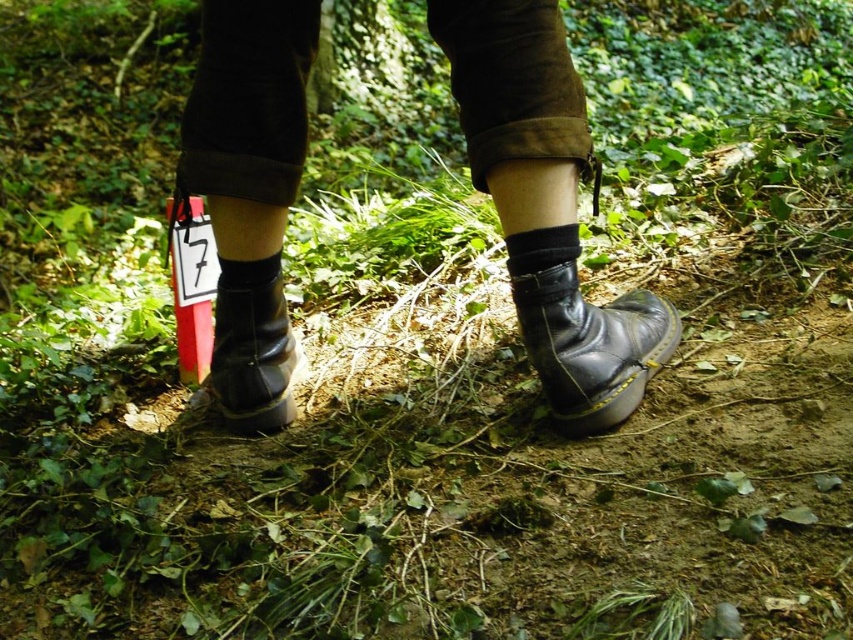
Question: Which of the following is the farthest from the observer?

Choices:
 (A) (532, 285)
 (B) (225, 276)
 (C) (514, 253)
 (D) (254, 419)

Answer: (B)

Question: Does black leather boots at center appear on the left side of black matte sock at lower center?

Choices:
 (A) yes
 (B) no

Answer: (B)

Question: Among these points, which one is nearest to the camera?

Choices:
 (A) (602, 396)
 (B) (260, 259)

Answer: (A)

Question: Is black leather boot at center smaller than black leather hiking boot at lower left?

Choices:
 (A) no
 (B) yes

Answer: (A)

Question: Can you confirm if black leather boot at center is wider than black cotton sock at center?

Choices:
 (A) yes
 (B) no

Answer: (A)

Question: Which object is closer to the camera taking this photo?

Choices:
 (A) black matte sock at lower center
 (B) black leather boots at center
 (C) black leather boot at center
 (D) black cotton sock at center

Answer: (B)